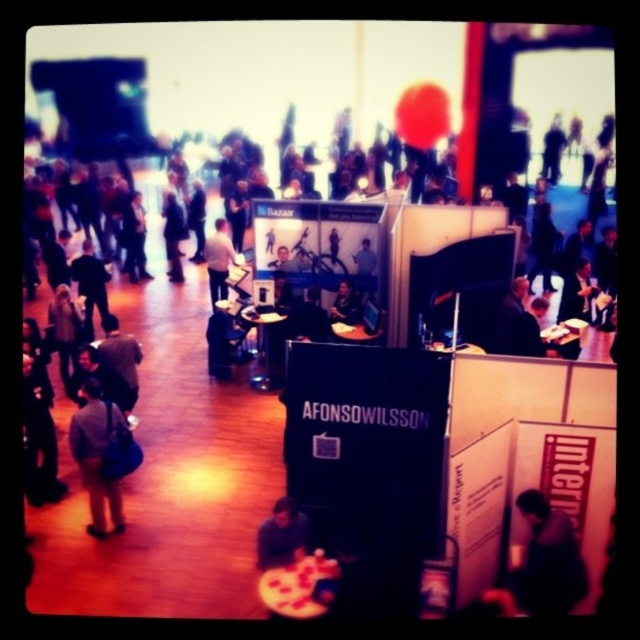
You are at a conference and need to locate the gray fabric jacket at left. According to the coordinates provided, where exactly is it positioned in the scene?

The gray fabric jacket at left is positioned at coordinates point (97, 456).